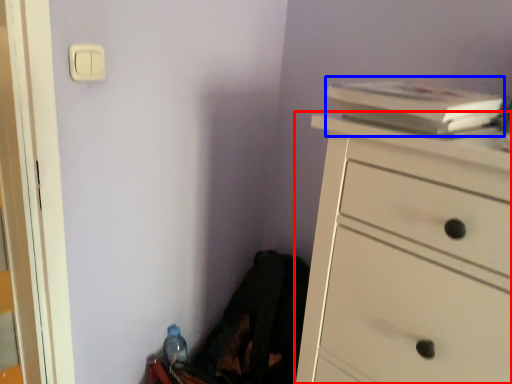
Question: Which object appears farthest to the camera in this image, chest of drawers (highlighted by a red box) or book (highlighted by a blue box)?

Choices:
 (A) chest of drawers
 (B) book

Answer: (B)